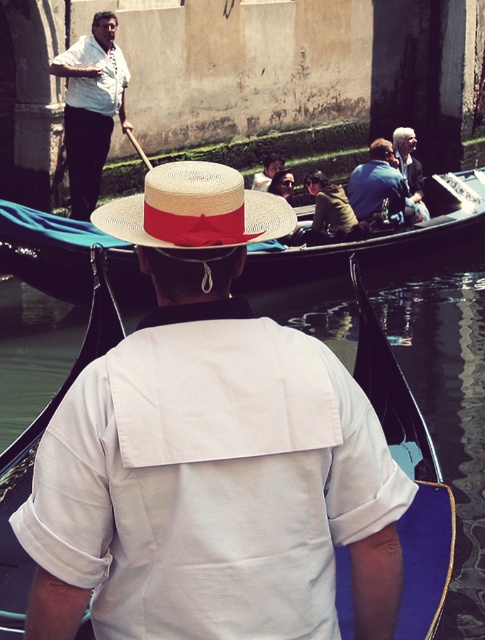
Question: Which of the following is the closest to the observer?

Choices:
 (A) (267, 182)
 (B) (388, 148)
 (C) (408, 161)

Answer: (B)

Question: Is gray wool jacket at upper center positioned at the back of smooth brown leather jacket at center?

Choices:
 (A) no
 (B) yes

Answer: (A)

Question: Which of the following is the closest to the observer?

Choices:
 (A) (418, 198)
 (B) (190, 216)
 (C) (272, 177)
 (D) (125, 80)

Answer: (B)

Question: Which point is closer to the camera?

Choices:
 (A) (226, 220)
 (B) (115, 26)
 (C) (392, 163)

Answer: (A)

Question: Does strawhat at center have a smaller size compared to smooth brown leather jacket at center?

Choices:
 (A) yes
 (B) no

Answer: (B)

Question: Observing the image, what is the correct spatial positioning of gray wool jacket at upper center in reference to smooth brown leather jacket at center?

Choices:
 (A) left
 (B) right

Answer: (B)